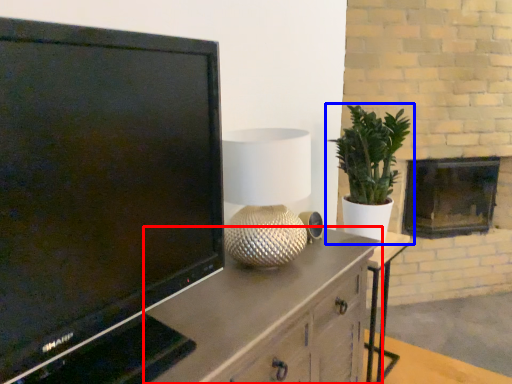
Question: Which object is closer to the camera taking this photo, cabinetry (highlighted by a red box) or houseplant (highlighted by a blue box)?

Choices:
 (A) cabinetry
 (B) houseplant

Answer: (A)